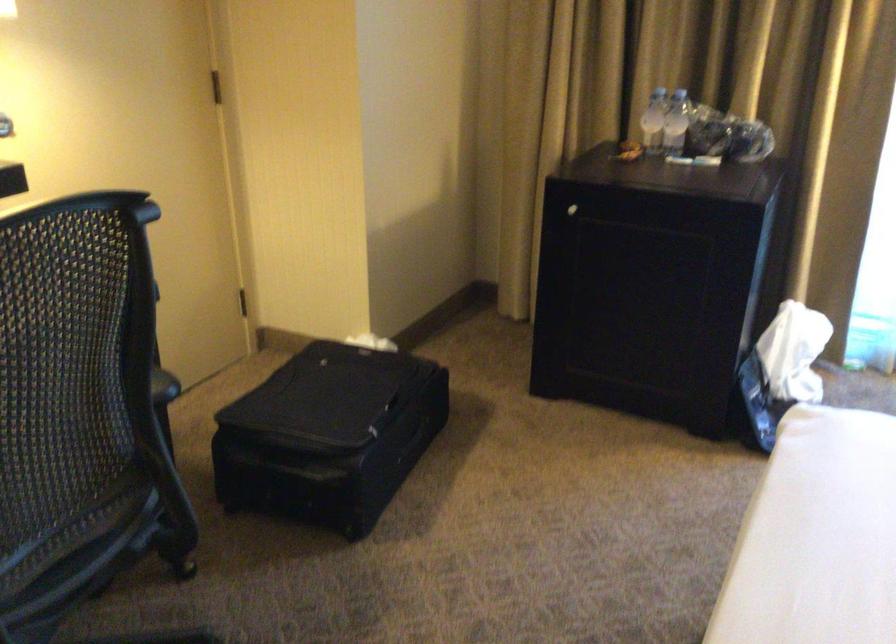
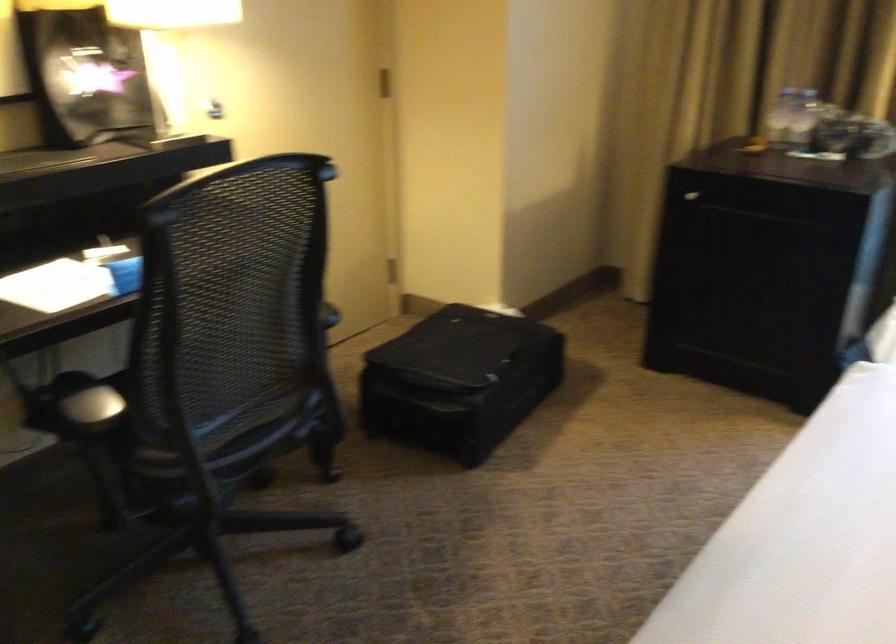
Question: Based on the continuous images, in which direction is the camera rotating? Reply with the corresponding letter.

Choices:
 (A) Left
 (B) Right
 (C) Up
 (D) Down

Answer: (A)